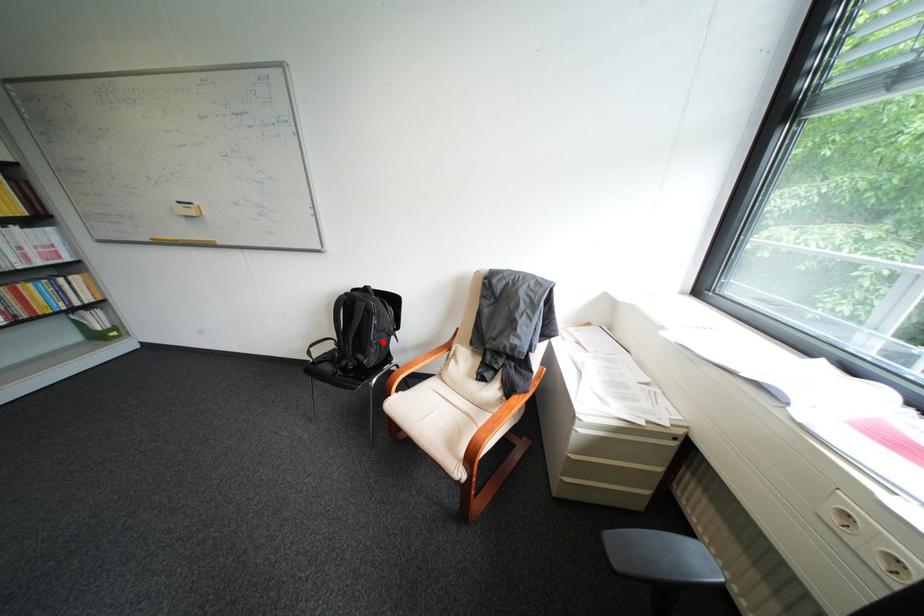
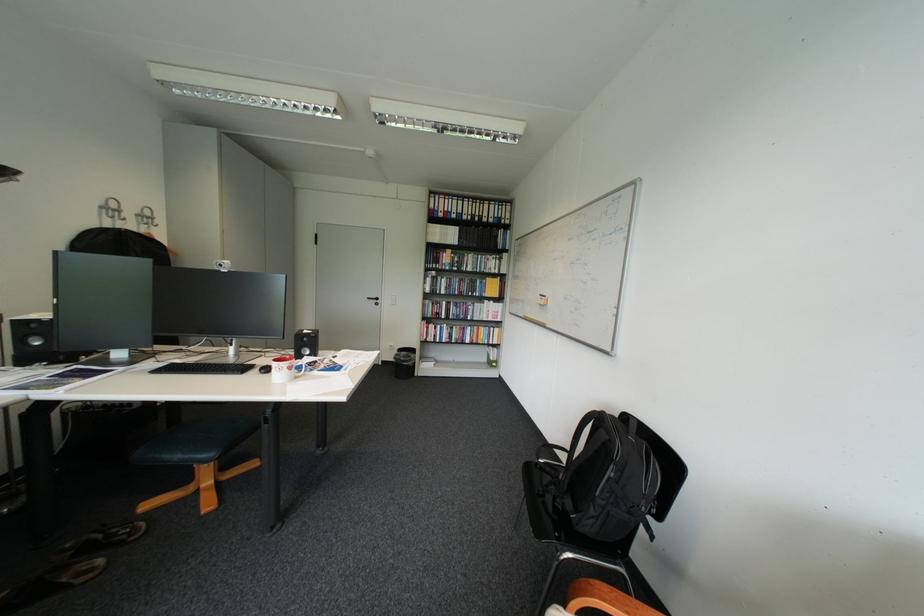
Where in the second image is the point corresponding to the highlighted location from the first image?

(608, 496)